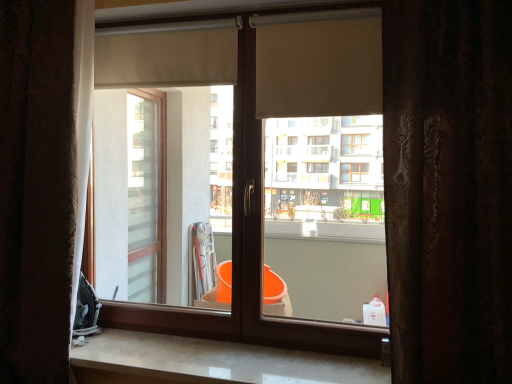
Question: Looking at their shapes, would you say white marble counter top at lower center is wider or thinner than beige fabric roller at upper center, the first shutter viewed from the right?

Choices:
 (A) thin
 (B) wide

Answer: (B)

Question: Is white marble counter top at lower center in front of or behind beige fabric roller at upper center, the 1th shutter when ordered from front to back, in the image?

Choices:
 (A) behind
 (B) front

Answer: (B)

Question: Estimate the real-world distances between objects in this image. Which object is farther from the beige fabric roller at upper left, which is the 1th shutter in back-to-front order?

Choices:
 (A) white marble counter top at lower center
 (B) beige fabric roller at upper center, which appears as the second shutter when viewed from the left
 (C) matte wood window at center
 (D) brown textured curtain at left, which is counted as the 2th curtain, starting from the right
 (E) brown textured curtain at right, which is counted as the first curtain, starting from the front

Answer: (A)

Question: Which object is positioned farthest from the white marble counter top at lower center?

Choices:
 (A) matte wood window at center
 (B) beige fabric roller at upper left, which appears as the 2th shutter when viewed from the right
 (C) brown textured curtain at left, marked as the 1th curtain in a back-to-front arrangement
 (D) brown textured curtain at right, which appears as the first curtain when viewed from the right
 (E) beige fabric roller at upper center, which appears as the second shutter when viewed from the left

Answer: (B)